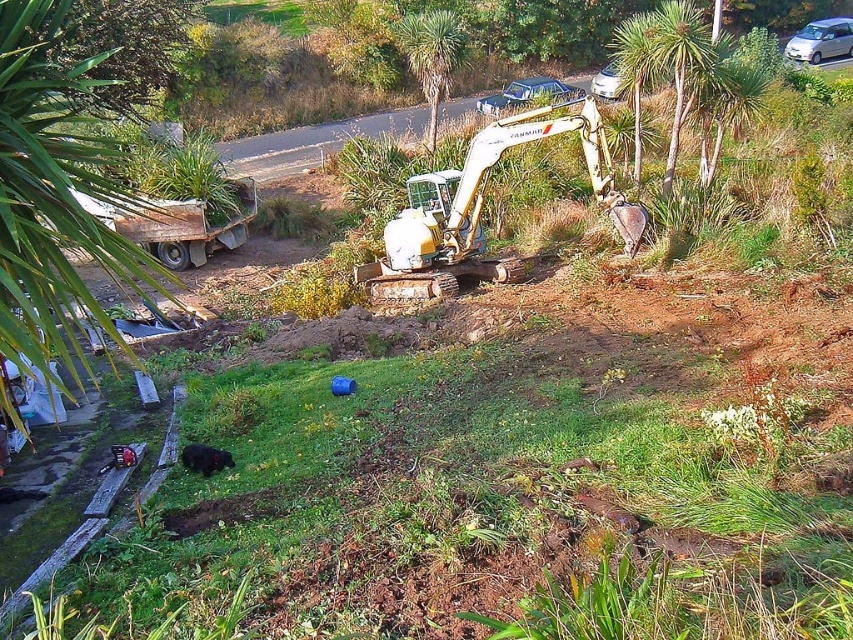
Question: Based on their relative distances, which object is farther from the green leafy tree at left?

Choices:
 (A) green leafy palm tree at upper center
 (B) green leafy palm tree at center
 (C) silver metallic car at upper right

Answer: (C)

Question: Is the position of metallic silver car at upper center more distant than that of silver metallic car at upper center?

Choices:
 (A) yes
 (B) no

Answer: (A)

Question: Can you confirm if green leafy tree at left is bigger than silver metallic car at upper right?

Choices:
 (A) no
 (B) yes

Answer: (B)

Question: Which object is the farthest from the silver metallic car at upper right?

Choices:
 (A) green leafy tree at left
 (B) green leafy palm tree at upper center

Answer: (A)

Question: Is yellow metallic excavator at center positioned before green leafy palm tree at center?

Choices:
 (A) no
 (B) yes

Answer: (B)

Question: Which of these objects is positioned farthest from the green leafy palm tree at upper right?

Choices:
 (A) metallic silver car at upper center
 (B) green leafy palm tree at center
 (C) yellow metallic excavator at center

Answer: (A)